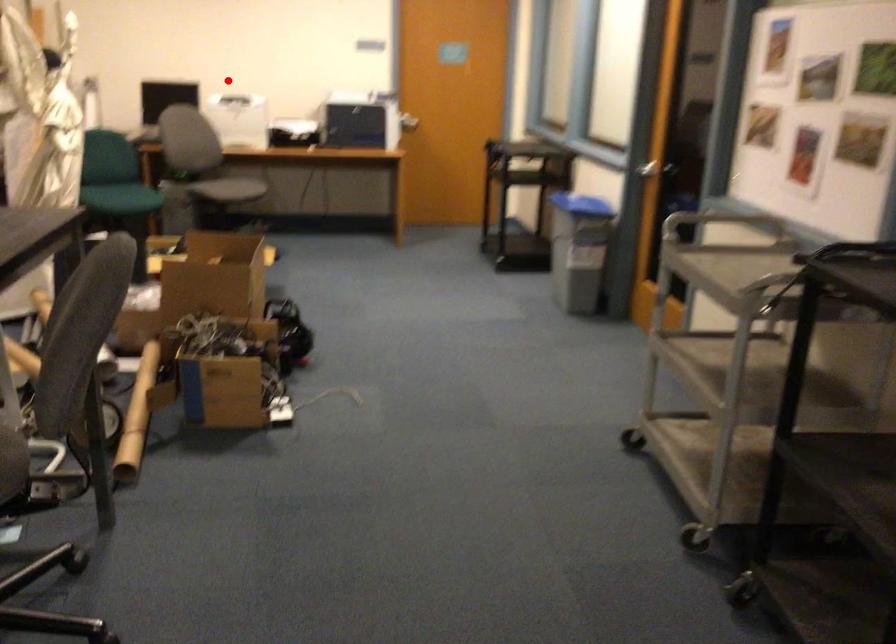
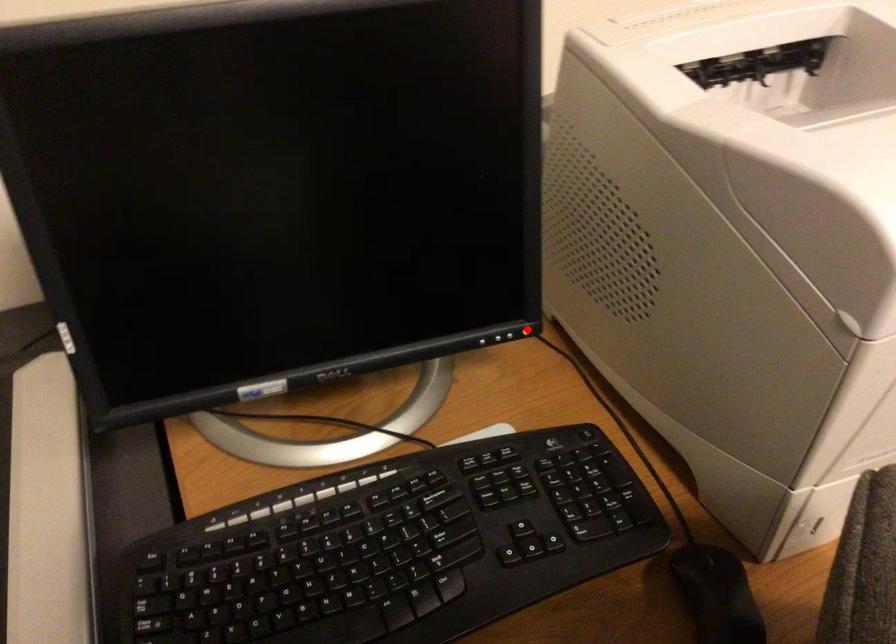
I am providing you with two images of the same scene from different viewpoints. A red point is marked on the first image and another point is marked on the second image. Is the marked point in image1 the same physical position as the marked point in image2?

No